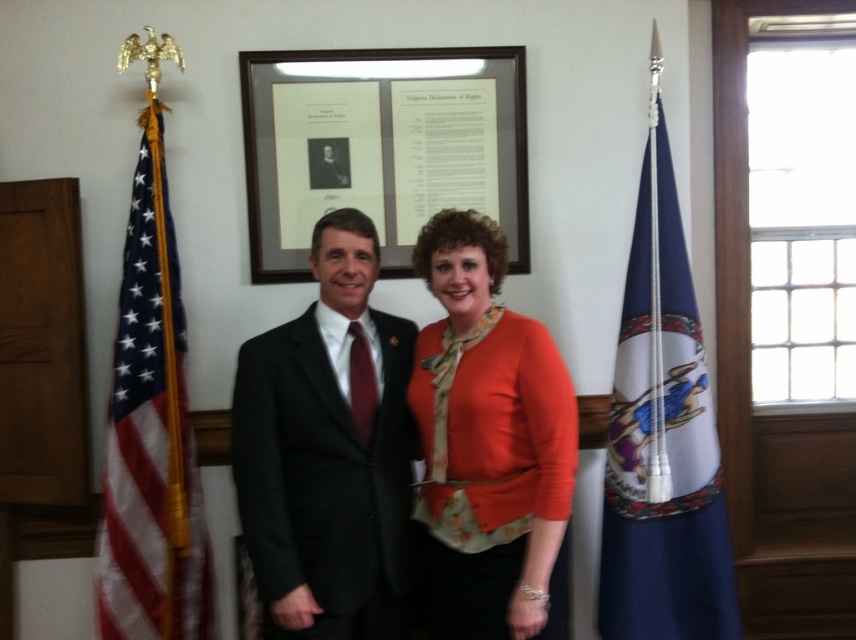
Question: Is orange matte sweater at center bigger than blue fabric flag at left?

Choices:
 (A) no
 (B) yes

Answer: (B)

Question: Is dark gray suit at center above wooden framed document at center?

Choices:
 (A) no
 (B) yes

Answer: (A)

Question: Which point is farther from the camera taking this photo?

Choices:
 (A) (378, 314)
 (B) (135, 353)
 (C) (449, 241)

Answer: (B)

Question: Considering the relative positions of dark gray suit at center and orange matte sweater at center in the image provided, where is dark gray suit at center located with respect to orange matte sweater at center?

Choices:
 (A) above
 (B) below

Answer: (B)

Question: Which of the following is the closest to the observer?

Choices:
 (A) (483, 148)
 (B) (308, 532)
 (C) (146, 284)

Answer: (B)

Question: Among these points, which one is nearest to the camera?

Choices:
 (A) (140, 604)
 (B) (298, 173)
 (C) (275, 440)
 (D) (551, 516)

Answer: (D)